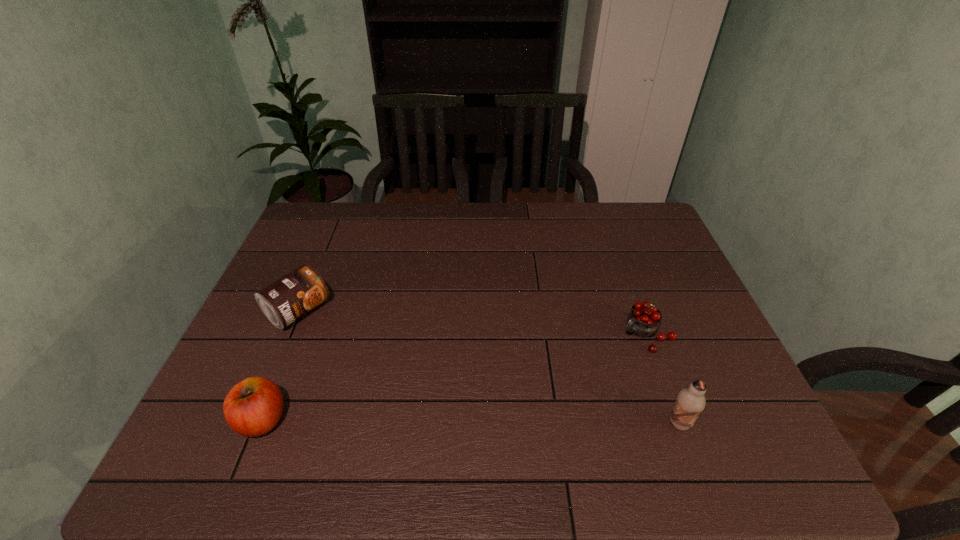
In order to click on apple in this screenshot , I will do `click(253, 407)`.

Find the location of `chocolate milk`. chocolate milk is located at coordinates (690, 402).

I want to click on can, so click(284, 301).

Find the location of a particular element. Image resolution: width=960 pixels, height=540 pixels. pot filled with cherries is located at coordinates (644, 319).

You are a GUI agent. You are given a task and a screenshot of the screen. Output one action in this format:
    pyautogui.click(x=<x>, y=<y>)
    Task: Click on the free space located 0.400m on the right of the apple
    This screenshot has width=960, height=540.
    Given the screenshot: What is the action you would take?
    pyautogui.click(x=470, y=420)

Image resolution: width=960 pixels, height=540 pixels. I want to click on vacant space located on the back of the chocolate milk, so click(x=649, y=339).

This screenshot has height=540, width=960. I want to click on vacant space located 0.310m on the front label of the can, so click(401, 389).

The width and height of the screenshot is (960, 540). Find the location of `free space located on the front label of the can`. free space located on the front label of the can is located at coordinates (375, 369).

The height and width of the screenshot is (540, 960). In order to click on free space located on the front label of the can in this screenshot , I will do `click(353, 353)`.

I want to click on free space located 0.140m on the handle side of the pot filled with cherries, so click(590, 375).